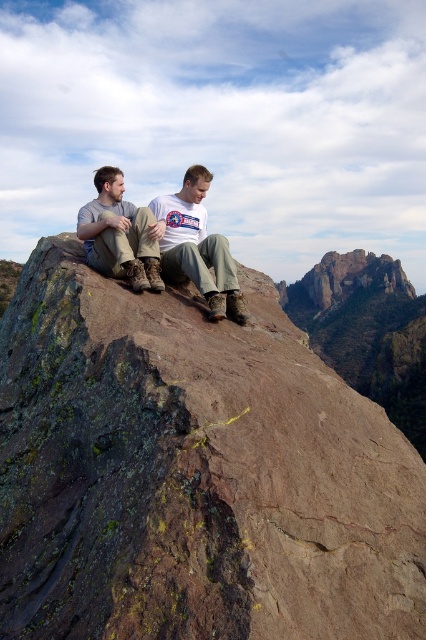
Question: Does rusty rock at center appear on the right side of matte brown boots at left?

Choices:
 (A) no
 (B) yes

Answer: (B)

Question: Which point is closer to the camera?

Choices:
 (A) white t-shirt at center
 (B) matte brown boots at left
 (C) rugged stone peak at center

Answer: (A)

Question: Which point appears closest to the camera in this image?

Choices:
 (A) (124, 451)
 (B) (229, 253)

Answer: (A)

Question: Observing the image, what is the correct spatial positioning of matte brown boots at left in reference to rugged stone peak at center?

Choices:
 (A) right
 (B) left

Answer: (B)

Question: Can you confirm if rusty rock at center is positioned to the right of matte brown boots at left?

Choices:
 (A) no
 (B) yes

Answer: (B)

Question: Which point is closer to the camera?

Choices:
 (A) (77, 310)
 (B) (152, 288)
 (C) (314, 296)

Answer: (A)